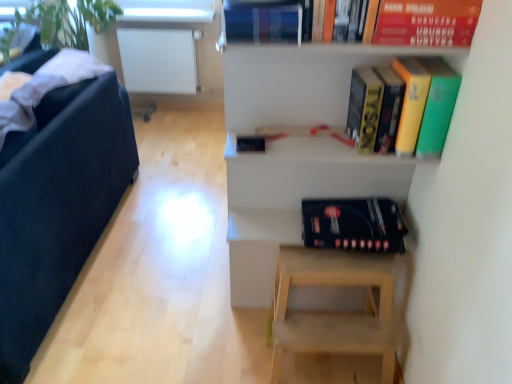
Question: Does white matte radiator at upper left appear on the right side of orange matte paperback book at upper right, which appears as the first paperback book when viewed from the right?

Choices:
 (A) no
 (B) yes

Answer: (A)

Question: Does white matte radiator at upper left have a smaller size compared to orange matte paperback book at upper right, which appears as the first paperback book when viewed from the right?

Choices:
 (A) no
 (B) yes

Answer: (A)

Question: Is white matte radiator at upper left aimed at orange matte paperback book at upper right, positioned as the second paperback book in left-to-right order?

Choices:
 (A) yes
 (B) no

Answer: (A)

Question: Considering the relative sizes of white matte radiator at upper left and orange matte paperback book at upper right, positioned as the second paperback book in left-to-right order, in the image provided, is white matte radiator at upper left wider than orange matte paperback book at upper right, positioned as the second paperback book in left-to-right order,?

Choices:
 (A) yes
 (B) no

Answer: (A)

Question: Considering the relative sizes of white matte radiator at upper left and orange matte paperback book at upper right, positioned as the second paperback book in left-to-right order, in the image provided, is white matte radiator at upper left thinner than orange matte paperback book at upper right, positioned as the second paperback book in left-to-right order,?

Choices:
 (A) no
 (B) yes

Answer: (A)

Question: From a real-world perspective, is white matte radiator at upper left located beneath orange matte paperback book at upper right, which appears as the first paperback book when viewed from the right?

Choices:
 (A) yes
 (B) no

Answer: (A)

Question: Considering the relative sizes of black fabric armchair at left and white matte shelf at upper right in the image provided, is black fabric armchair at left taller than white matte shelf at upper right?

Choices:
 (A) no
 (B) yes

Answer: (A)

Question: Are black fabric armchair at left and white matte shelf at upper right beside each other?

Choices:
 (A) yes
 (B) no

Answer: (B)

Question: From the image's perspective, does black fabric armchair at left appear lower than white matte shelf at upper right?

Choices:
 (A) no
 (B) yes

Answer: (B)

Question: Is white matte shelf at upper right at the back of black fabric armchair at left?

Choices:
 (A) no
 (B) yes

Answer: (B)

Question: From a real-world perspective, is black fabric armchair at left under white matte shelf at upper right?

Choices:
 (A) yes
 (B) no

Answer: (A)

Question: From the image's perspective, is black fabric armchair at left located above white matte shelf at upper right?

Choices:
 (A) no
 (B) yes

Answer: (A)

Question: Is the depth of hardcover book at upper right less than that of black fabric armchair at left?

Choices:
 (A) yes
 (B) no

Answer: (B)